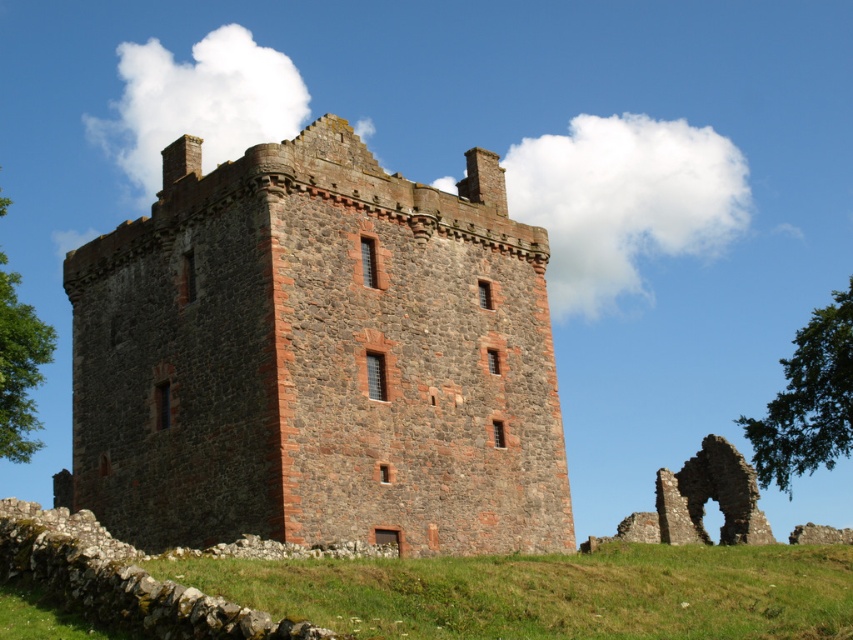
Measure the distance between rustic stone tower at center and camera.

rustic stone tower at center is 38.43 meters away from camera.

Does rustic stone tower at center lie in front of green grassy at lower center?

No.

The image size is (853, 640). Describe the element at coordinates (318, 356) in the screenshot. I see `rustic stone tower at center` at that location.

Where is `rustic stone tower at center`? This screenshot has height=640, width=853. rustic stone tower at center is located at coordinates (318, 356).

Does rustic stone tower at center come in front of green leafy tree at upper right?

Yes, rustic stone tower at center is in front of green leafy tree at upper right.

Is point (216, 410) more distant than point (811, 385)?

No, it is in front of (811, 385).

Consider the image. Who is more forward, (166, 161) or (805, 444)?

Point (166, 161) is in front.

Where is `rustic stone tower at center`? Image resolution: width=853 pixels, height=640 pixels. rustic stone tower at center is located at coordinates 318,356.

Can you confirm if green grassy at lower center is taller than green leafy tree at left?

No.

Can you confirm if green grassy at lower center is positioned below green leafy tree at left?

Indeed, green grassy at lower center is positioned under green leafy tree at left.

Is point (480, 572) positioned behind point (4, 452)?

No, it is in front of (4, 452).

I want to click on green grassy at lower center, so click(550, 593).